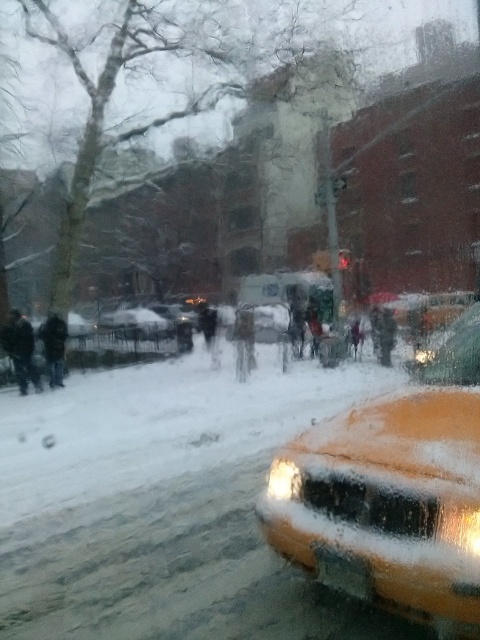
Question: Is dark brown leather jacket at left wider than dark gray coat at center?

Choices:
 (A) yes
 (B) no

Answer: (B)

Question: Is snow-covered sedan at center in front of dark brown leather jacket at left?

Choices:
 (A) no
 (B) yes

Answer: (A)

Question: Does dark gray fabric coat at center come in front of dark gray coat at center?

Choices:
 (A) yes
 (B) no

Answer: (A)

Question: Among these points, which one is nearest to the camera?

Choices:
 (A) (56, 332)
 (B) (136, 310)
 (C) (204, 320)

Answer: (A)

Question: Which object is the farthest from the dark gray fabric coat at center?

Choices:
 (A) dark brown fur coat at center
 (B) dark gray coat at center
 (C) dark brown leather jacket at left
 (D) black matte jacket at center

Answer: (B)

Question: Based on their relative distances, which object is farther from the dark brown leather jacket at left?

Choices:
 (A) orange matte taxi at lower right
 (B) dark gray fabric coat at center
 (C) black matte jacket at center

Answer: (A)